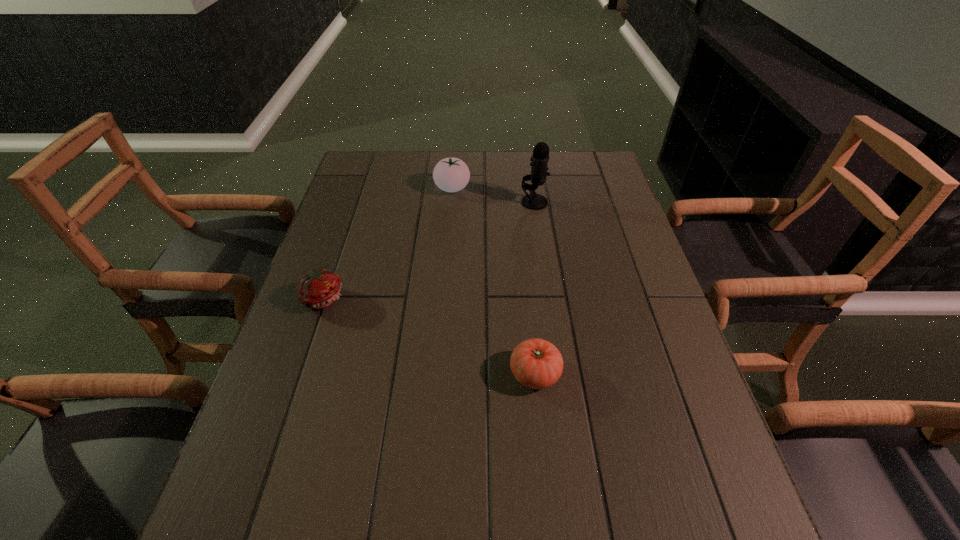
Locate which tomato ranks second in proximity to the microphone. Please provide its 2D coordinates. Your answer should be formatted as a tuple, i.e. [(x, y)], where the tuple contains the x and y coordinates of a point satisfying the conditions above.

[(536, 363)]

Locate an element on the screen. The image size is (960, 540). the third closest tomato relative to the microphone is located at coordinates (320, 288).